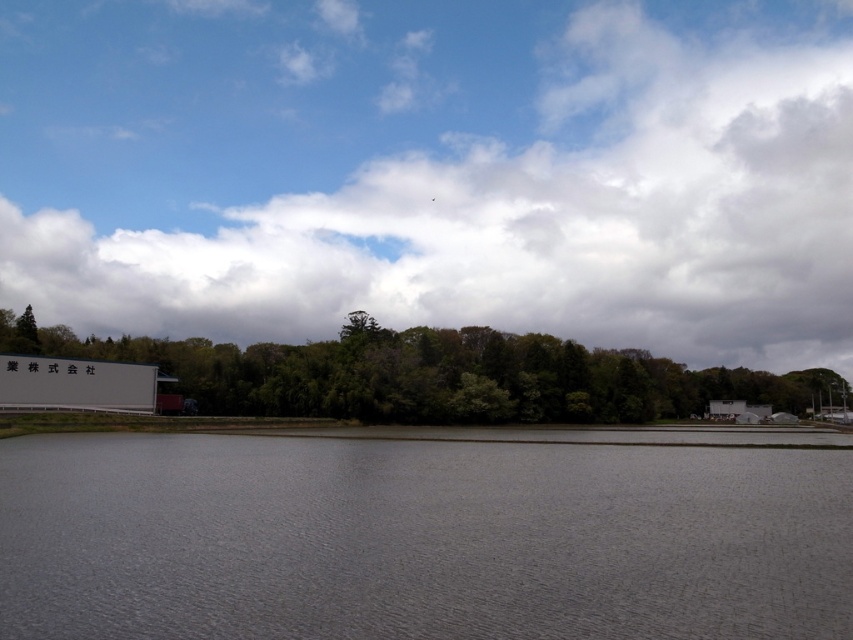
You are an architect designing a new observatory. You want to ensure that the observatory has a clear view of the sky without any obstructions. Given the scene described, which object between the white fluffy cloud at upper center and the gray matte water at center might block the view, and why?

The white fluffy cloud at upper center might block the view because its width is larger than the gray matte water at center, making it a larger obstruction in the sky.

You are standing on the dock and see the gray matte water at center and the green leafy trees at lower center. Which object is positioned to the left of the other?

The gray matte water at center is to the left of green leafy trees at lower center.

You are an observer looking at the scene. You see the white fluffy cloud at upper center and the gray matte water at center. Which object is located to the right of the other?

The white fluffy cloud at upper center is positioned on the right side of gray matte water at center.